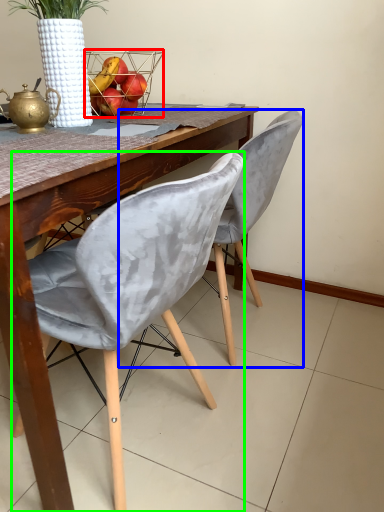
Question: Estimate the real-world distances between objects in this image. Which object is farther from basket (highlighted by a red box), chair (highlighted by a blue box) or chair (highlighted by a green box)?

Choices:
 (A) chair
 (B) chair

Answer: (B)